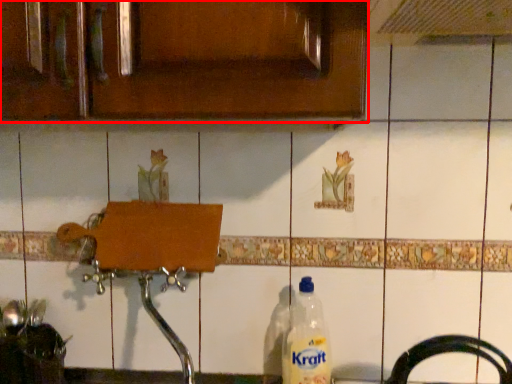
Question: In this image, where is cabinetry (annotated by the red box) located relative to bottle?

Choices:
 (A) left
 (B) right

Answer: (A)